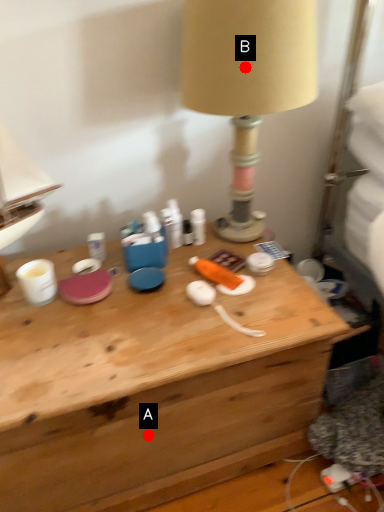
Question: Two points are circled on the image, labeled by A and B beside each circle. Which point is closer to the camera?

Choices:
 (A) A is closer
 (B) B is closer

Answer: (B)